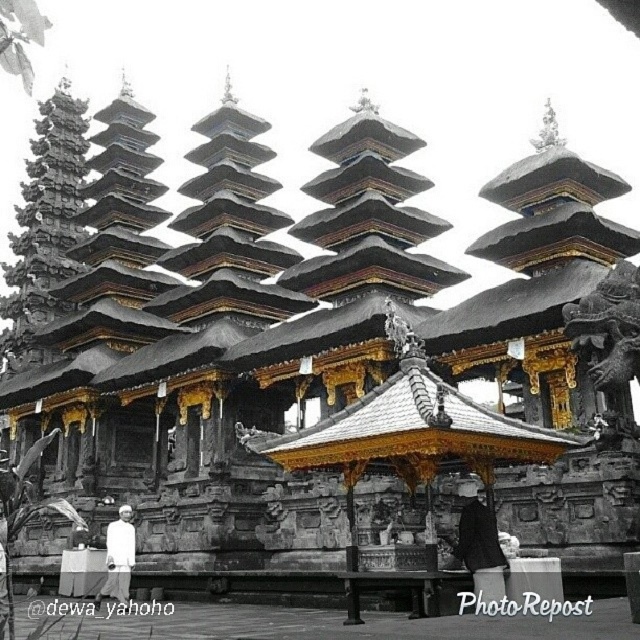
Consider the image. Which of these two, dark gray fabric coat at center or white cloth at lower left, stands shorter?

dark gray fabric coat at center is shorter.

Between dark gray fabric coat at center and white cloth at lower left, which one is positioned lower?

white cloth at lower left

Find the location of a particular element. This screenshot has width=640, height=640. dark gray fabric coat at center is located at coordinates (481, 547).